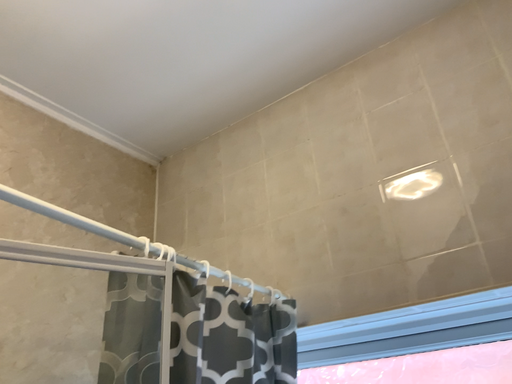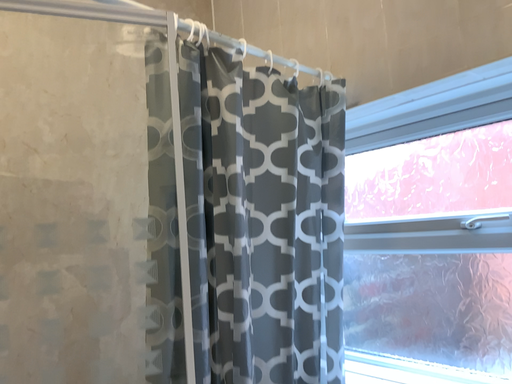
Question: How did the camera likely rotate when shooting the video?

Choices:
 (A) rotated upward
 (B) rotated downward

Answer: (B)